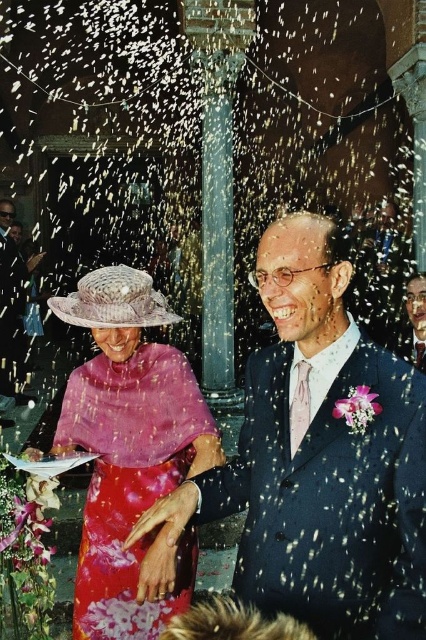
Question: Which of the following is the closest to the observer?

Choices:
 (A) matte black suit at left
 (B) smooth blue suit at center

Answer: (B)

Question: Does matte black suit at left appear over smooth blue suit at center?

Choices:
 (A) yes
 (B) no

Answer: (A)

Question: Which object is closer to the camera taking this photo?

Choices:
 (A) smooth blue suit at center
 (B) matte black suit at center

Answer: (B)

Question: Is matte pink fabric dress at center smaller than matte black suit at left?

Choices:
 (A) no
 (B) yes

Answer: (B)

Question: From the image, what is the correct spatial relationship of matte black suit at center in relation to smooth blue suit at center?

Choices:
 (A) above
 (B) below

Answer: (A)

Question: Which point is closer to the camera?

Choices:
 (A) (419, 307)
 (B) (88, 636)

Answer: (B)